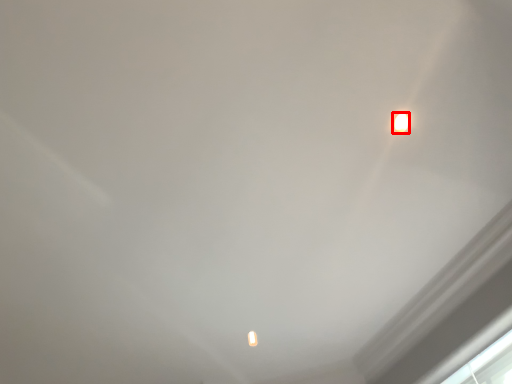
Question: From the image, what is the correct spatial relationship of lamp (annotated by the red box) in relation to window?

Choices:
 (A) left
 (B) right

Answer: (A)